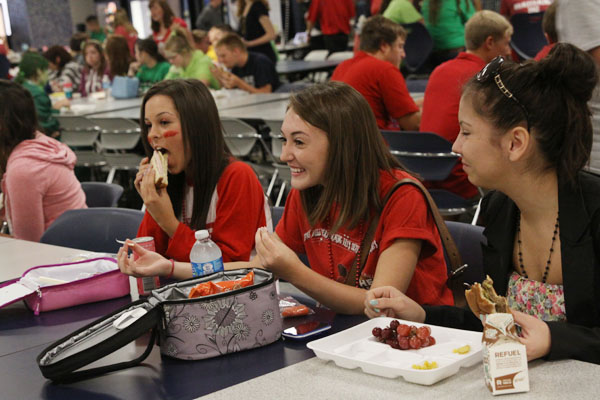
Where is `chair`? The image size is (600, 400). chair is located at coordinates (106, 224), (113, 140), (78, 130), (238, 134), (414, 145).